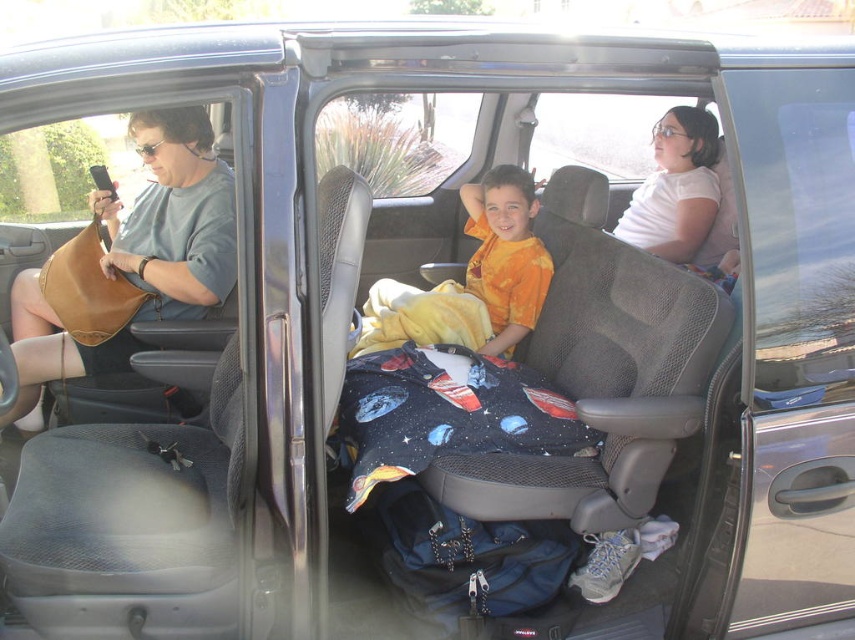
How much distance is there between orange cotton shirt at center and orange tie-dye shirt at center?

A distance of 2.30 inches exists between orange cotton shirt at center and orange tie-dye shirt at center.

Is orange cotton shirt at center positioned at the back of orange tie-dye shirt at center?

No.

Where is `orange cotton shirt at center`? The width and height of the screenshot is (855, 640). orange cotton shirt at center is located at coordinates (473, 280).

Which is more to the right, leather handbag at left or orange tie-dye shirt at center?

From the viewer's perspective, orange tie-dye shirt at center appears more on the right side.

Is point (28, 304) positioned in front of point (514, 346)?

That is True.

Is point (222, 291) farther from viewer compared to point (503, 307)?

No, it is not.

The width and height of the screenshot is (855, 640). What are the coordinates of `leather handbag at left` in the screenshot? It's located at (174, 218).

Which of these two, leather handbag at left or orange cotton shirt at center, stands shorter?

orange cotton shirt at center is shorter.

Is leather handbag at left below orange cotton shirt at center?

Indeed, leather handbag at left is positioned under orange cotton shirt at center.

Is point (149, 268) farther from viewer compared to point (541, 304)?

No, it is not.

Where is `leather handbag at left`? leather handbag at left is located at coordinates (174, 218).